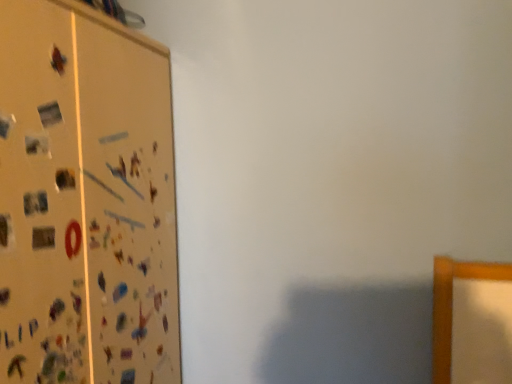
Find the location of `wooden fridge at left`. wooden fridge at left is located at coordinates (85, 200).

The width and height of the screenshot is (512, 384). Describe the element at coordinates (85, 200) in the screenshot. I see `wooden fridge at left` at that location.

Measure the distance between wooden fridge at left and camera.

wooden fridge at left is 29.18 inches away from camera.

Locate an element on the screen. Image resolution: width=512 pixels, height=384 pixels. wooden fridge at left is located at coordinates (85, 200).